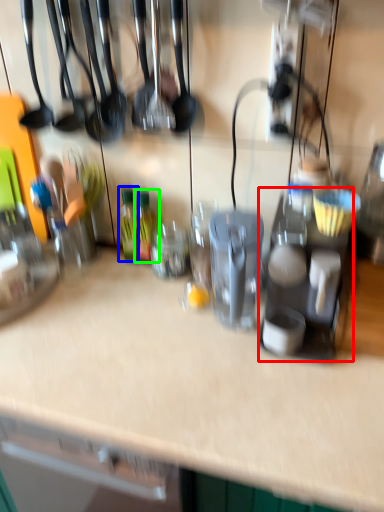
Question: Which object is positioned closest to appliance (highlighted by a red box)? Select from bottle (highlighted by a blue box) and bottle (highlighted by a green box).

Choices:
 (A) bottle
 (B) bottle

Answer: (B)